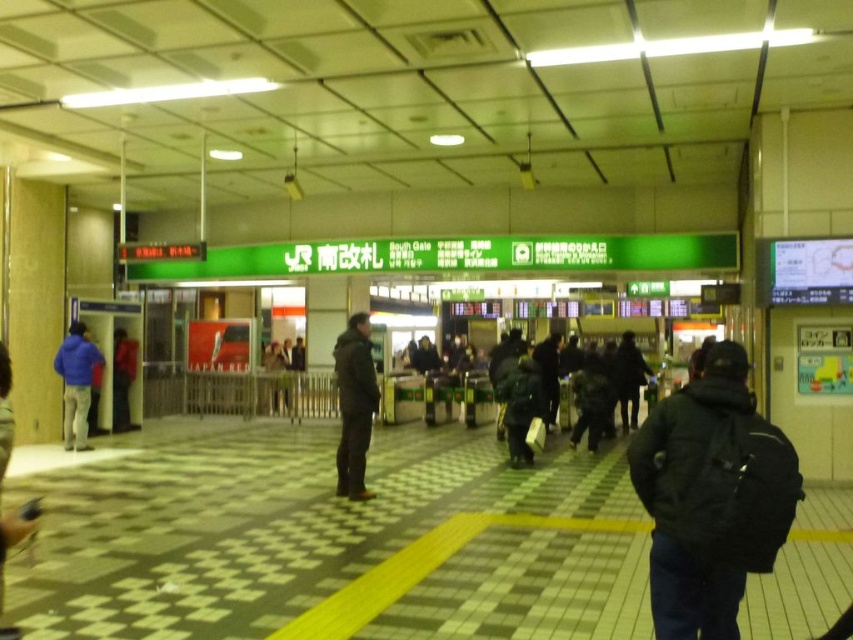
Question: Among these objects, which one is farthest from the camera?

Choices:
 (A) dark green jacket at center
 (B) matte black backpack at left
 (C) black matte jacket at center

Answer: (B)

Question: Considering the real-world distances, which object is closest to the blue fleece jacket at left?

Choices:
 (A) black matte jacket at right
 (B) dark matte jacket at center
 (C) dark blue jacket at left

Answer: (B)

Question: Can you confirm if black matte jacket at center is positioned below blue fleece jacket at left?

Choices:
 (A) yes
 (B) no

Answer: (B)

Question: Does black matte jacket at right have a smaller size compared to dark matte jacket at center?

Choices:
 (A) yes
 (B) no

Answer: (B)

Question: Among these objects, which one is farthest from the camera?

Choices:
 (A) dark green jacket at center
 (B) matte black backpack at left
 (C) blue fleece jacket at left

Answer: (B)

Question: Can you confirm if dark green jacket at center is positioned above matte black backpack at left?

Choices:
 (A) no
 (B) yes

Answer: (A)